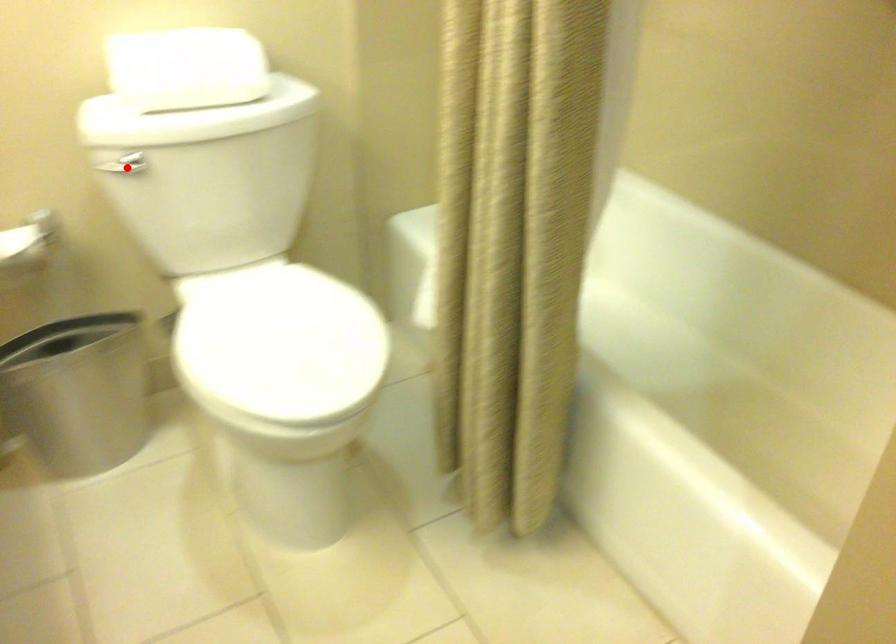
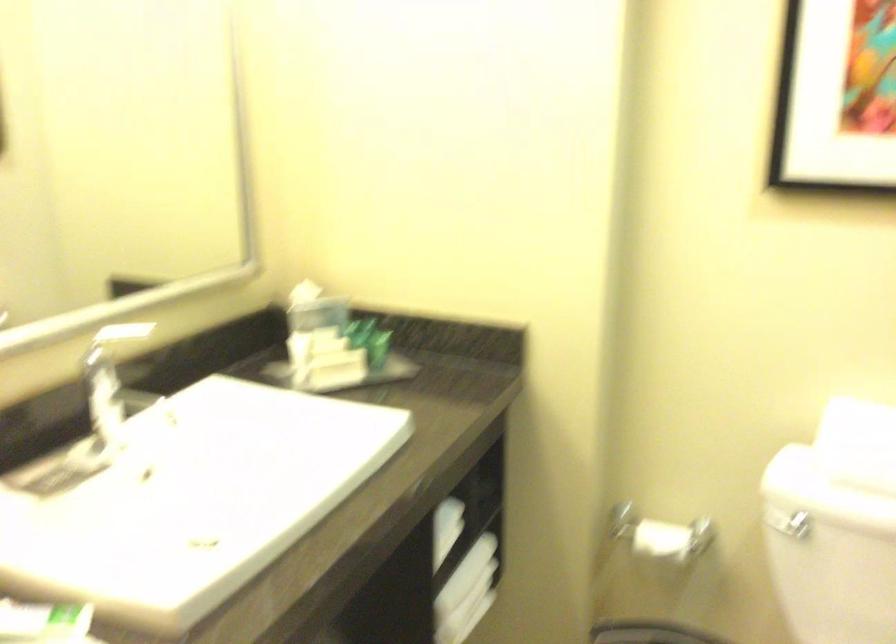
Find the pixel in the second image that matches the highlighted location in the first image.

(788, 524)